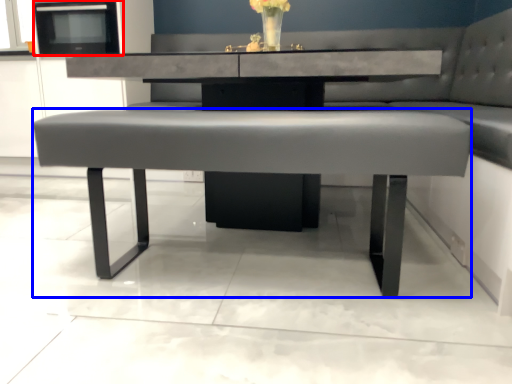
Question: Which object is further to the camera taking this photo, appliance (highlighted by a red box) or coffee table (highlighted by a blue box)?

Choices:
 (A) appliance
 (B) coffee table

Answer: (A)